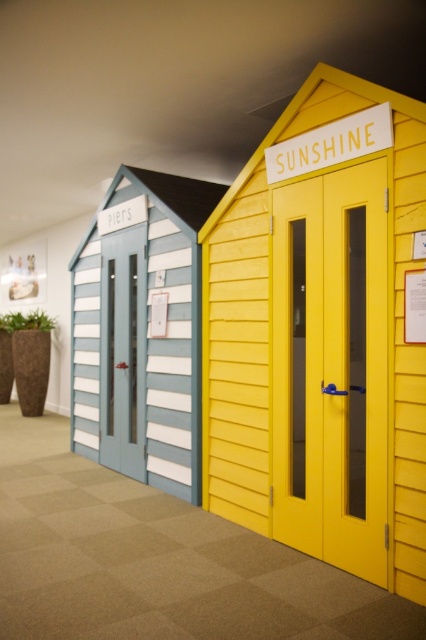
You are standing in front of two beach huts. The left one has a matte white door at center and the right one has a yellow matte door at center. Which door should you approach if you want to go to the Sunshine Hut?

The yellow matte door at center is to the right of the matte white door at center, so you should approach the yellow matte door at center to enter the Sunshine Hut.

You are standing in a room with two beach huts. You need to locate the matte white door at center. Which direction should you turn to face the yellow wooden beach hut at center?

The yellow wooden beach hut at center is to the right of the matte white door at center. So, if you are facing the matte white door at center, you should turn to your right to face the yellow wooden beach hut at center.